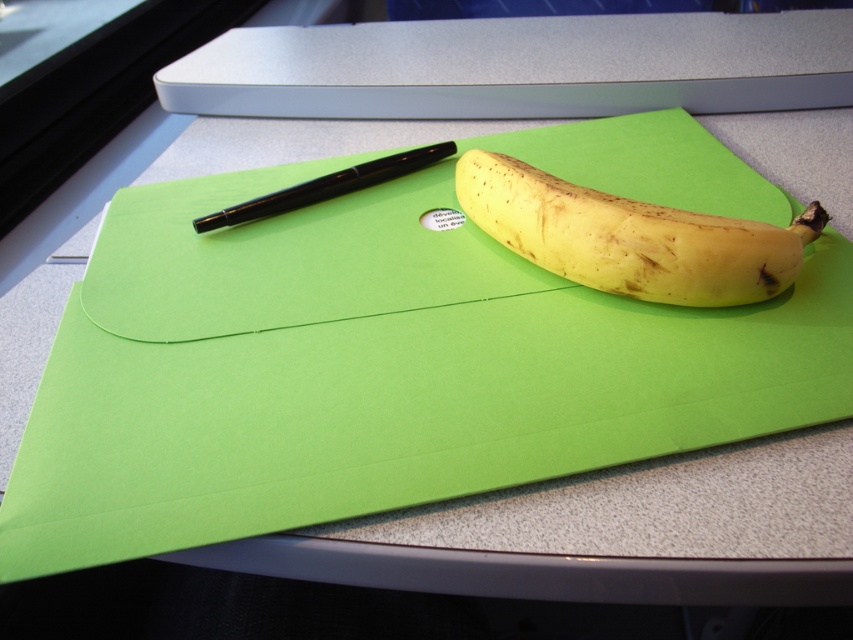
Question: Considering the real-world distances, which object is closest to the yellow matte banana at center?

Choices:
 (A) green paper at center
 (B) black glossy pen at upper left

Answer: (A)

Question: Based on their relative distances, which object is nearer to the black glossy pen at upper left?

Choices:
 (A) green paper at center
 (B) yellow matte banana at center

Answer: (A)

Question: Where is green paper at center located in relation to black glossy pen at upper left in the image?

Choices:
 (A) left
 (B) right

Answer: (B)

Question: Is yellow matte banana at center to the left of black glossy pen at upper left from the viewer's perspective?

Choices:
 (A) no
 (B) yes

Answer: (A)

Question: Is green paper at center positioned in front of yellow matte banana at center?

Choices:
 (A) yes
 (B) no

Answer: (A)

Question: Based on their relative distances, which object is farther from the black glossy pen at upper left?

Choices:
 (A) green paper at center
 (B) yellow matte banana at center

Answer: (B)